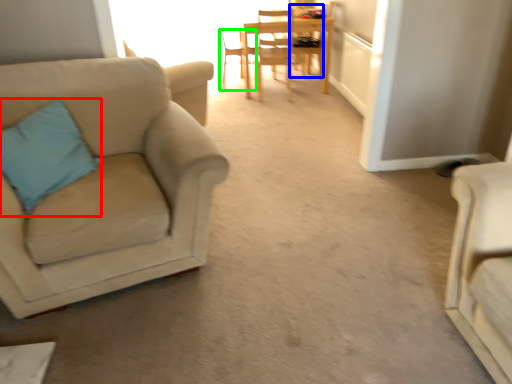
Question: Which object is positioned farthest from pillow (highlighted by a red box)? Select from chair (highlighted by a blue box) and chair (highlighted by a green box).

Choices:
 (A) chair
 (B) chair

Answer: (A)